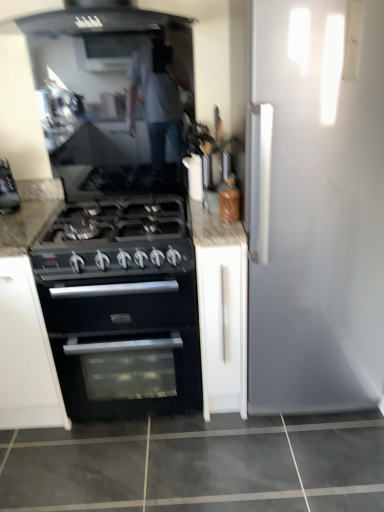
Question: From the image's perspective, is white matte cabinet at center on black matte gas stove at center?

Choices:
 (A) no
 (B) yes

Answer: (A)

Question: Could you tell me if white matte cabinet at center is facing black matte gas stove at center?

Choices:
 (A) yes
 (B) no

Answer: (B)

Question: Is white matte cabinet at center beside black matte gas stove at center?

Choices:
 (A) yes
 (B) no

Answer: (B)

Question: Can you confirm if white matte cabinet at center is thinner than black matte gas stove at center?

Choices:
 (A) yes
 (B) no

Answer: (A)

Question: Is white matte cabinet at center located outside black matte gas stove at center?

Choices:
 (A) yes
 (B) no

Answer: (A)

Question: In terms of size, does white matte cabinet at center appear bigger or smaller than black matte gas stove at center?

Choices:
 (A) small
 (B) big

Answer: (B)

Question: Is white matte cabinet at center wider or thinner than black matte gas stove at center?

Choices:
 (A) thin
 (B) wide

Answer: (A)

Question: Considering their positions, is white matte cabinet at center located in front of or behind black matte gas stove at center?

Choices:
 (A) front
 (B) behind

Answer: (B)

Question: In the image, is white matte cabinet at center on the left side or the right side of black matte gas stove at center?

Choices:
 (A) right
 (B) left

Answer: (A)

Question: Is point tap(39, 262) closer or farther from the camera than point tap(100, 287)?

Choices:
 (A) closer
 (B) farther

Answer: (A)

Question: Is black matte gas stove at center bigger or smaller than black matte oven at center?

Choices:
 (A) small
 (B) big

Answer: (A)

Question: From the image's perspective, is black matte gas stove at center located above or below black matte oven at center?

Choices:
 (A) above
 (B) below

Answer: (A)

Question: Considering the positions of black matte gas stove at center and black matte oven at center in the image, is black matte gas stove at center taller or shorter than black matte oven at center?

Choices:
 (A) short
 (B) tall

Answer: (A)

Question: Visually, is black matte oven at center positioned to the left or to the right of black matte gas stove at center?

Choices:
 (A) right
 (B) left

Answer: (A)

Question: From the image's perspective, is black matte oven at center above or below black matte gas stove at center?

Choices:
 (A) above
 (B) below

Answer: (B)